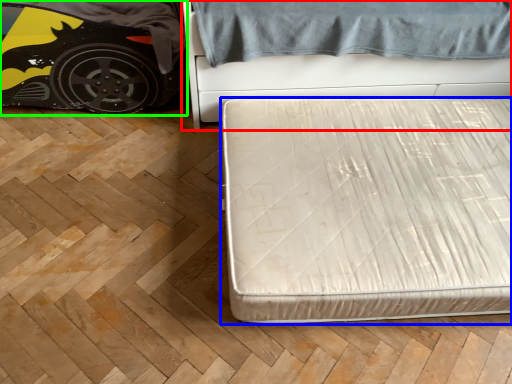
Question: Which object is positioned closest to bed (highlighted by a red box)? Select from bed (highlighted by a blue box) and car (highlighted by a green box).

Choices:
 (A) bed
 (B) car

Answer: (A)